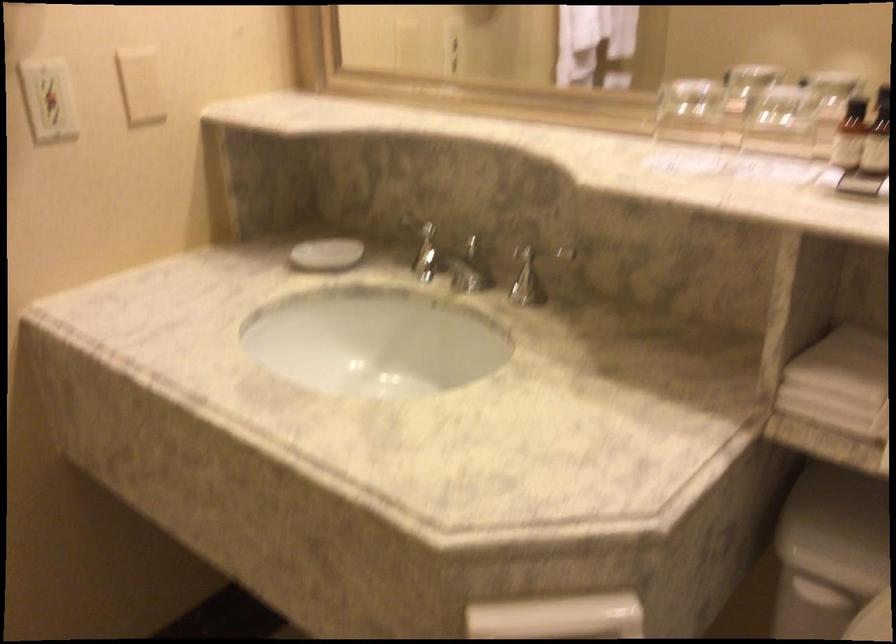
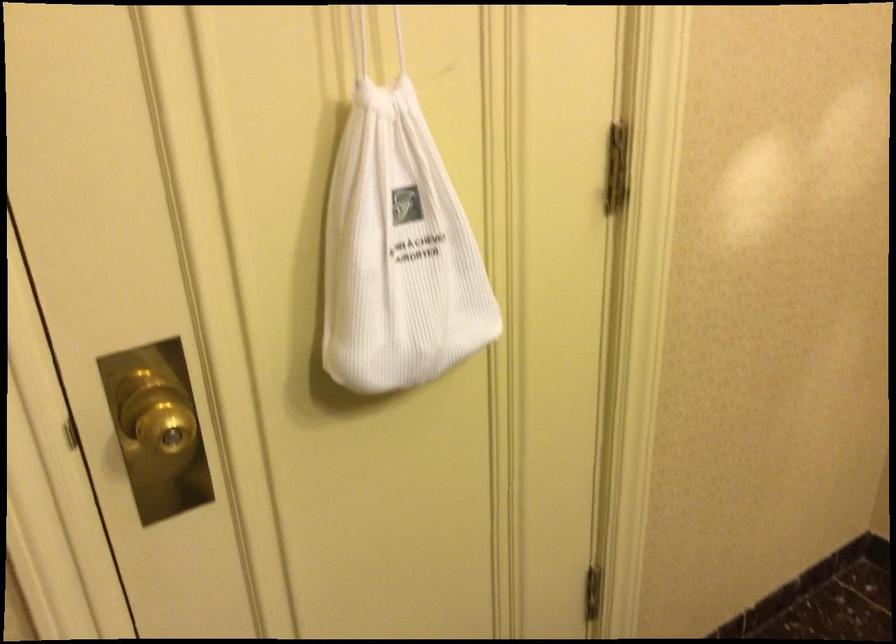
The images are taken continuously from a first-person perspective. In which direction is your viewpoint rotating?

The camera rotated toward left-down.